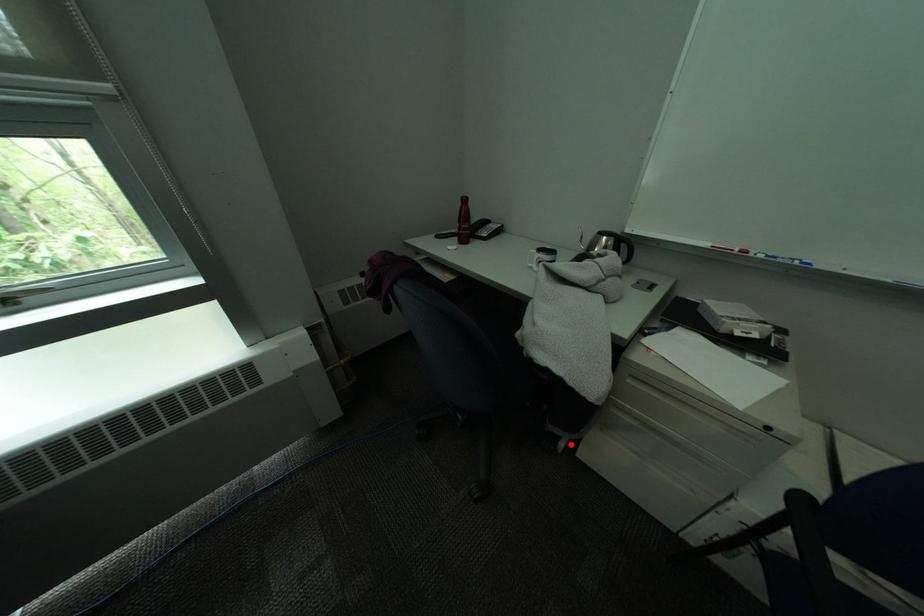
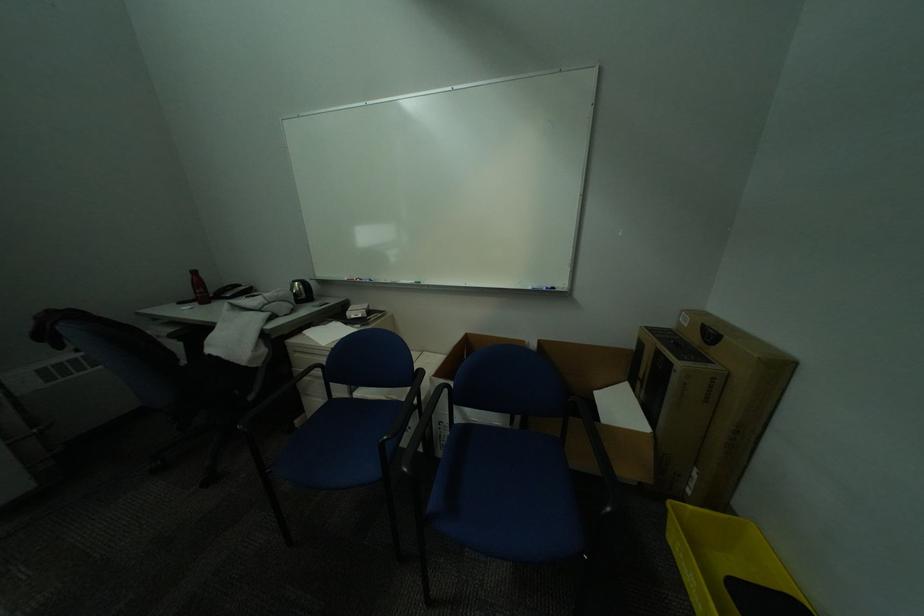
Question: I am providing you with two images of the same scene from different viewpoints. Given a red point in image1, look at the same physical point in image2. Is it:

Choices:
 (A) Closer to the viewpoint
 (B) Farther from the viewpoint

Answer: (B)